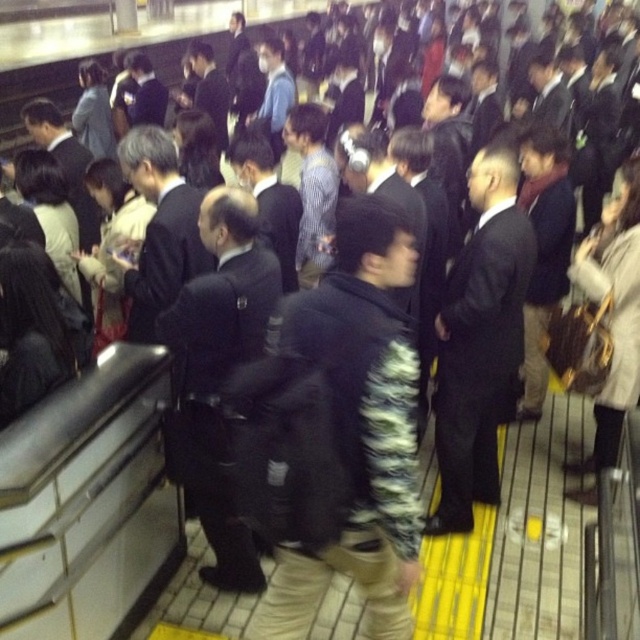
Where is `fluffy black jacket at center`? fluffy black jacket at center is located at coordinates (348, 428).

Does fluffy black jacket at center have a greater height compared to dark blue uniform at center?

No, fluffy black jacket at center is not taller than dark blue uniform at center.

Locate an element on the screen. This screenshot has height=640, width=640. fluffy black jacket at center is located at coordinates (348, 428).

Which is more to the left, fluffy black jacket at center or black suit at center?

Positioned to the left is fluffy black jacket at center.

Does fluffy black jacket at center appear over black suit at center?

Incorrect, fluffy black jacket at center is not positioned above black suit at center.

Between point (378, 305) and point (492, 504), which one is positioned in front?

Point (378, 305)

Find the location of a particular element. The width and height of the screenshot is (640, 640). fluffy black jacket at center is located at coordinates (348, 428).

Does point (474, 340) lie in front of point (177, 301)?

No, it is not.

Who is higher up, black suit at center or dark blue uniform at center?

black suit at center

Between point (477, 474) and point (211, 273), which one is positioned behind?

Point (477, 474)

Locate an element on the screen. black suit at center is located at coordinates (480, 340).